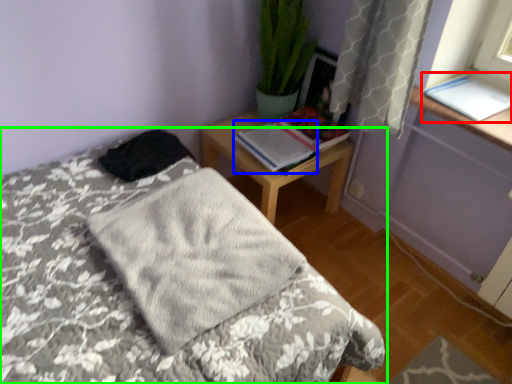
Question: Which object is the farthest from book (highlighted by a red box)? Choose among these: book (highlighted by a blue box) or bed (highlighted by a green box).

Choices:
 (A) book
 (B) bed

Answer: (B)